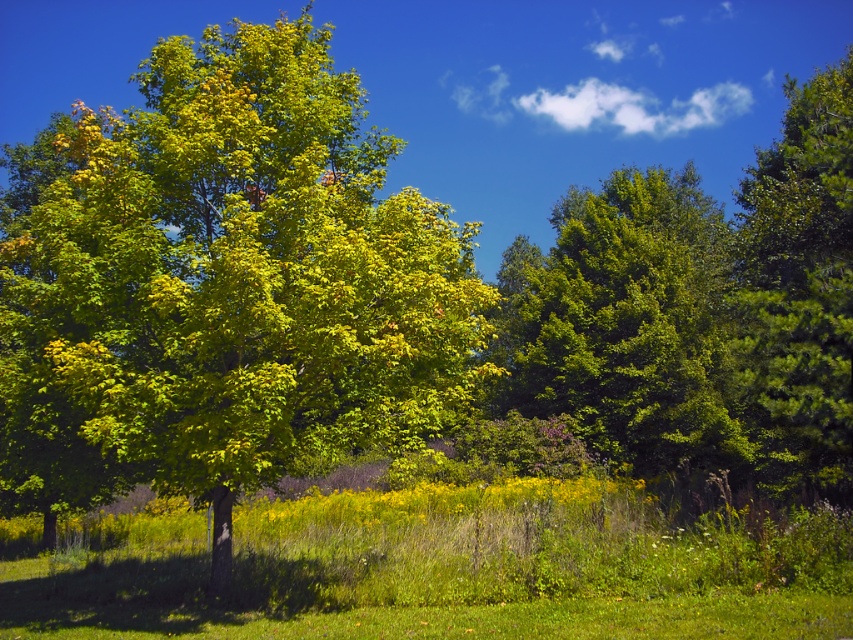
You are a photographer standing at the edge of the grassy area in the scene. You want to take a photo that includes both the point at coordinates point (x=138, y=275) and point (x=785, y=465). Which point will appear closer to the top of your camera viewfinder?

Point (x=785, y=465) will appear closer to the top of the camera viewfinder because it has a higher y coordinate than point (x=138, y=275).

You are standing in the middle of the field of yellow wildflowers and want to walk towards the green leafy tree at center. Which direction should you walk to avoid the green matte tree at right?

Since the green leafy tree at center is below the green matte tree at right, you should walk towards the lower direction to reach the green leafy tree at center without encountering the green matte tree at right.